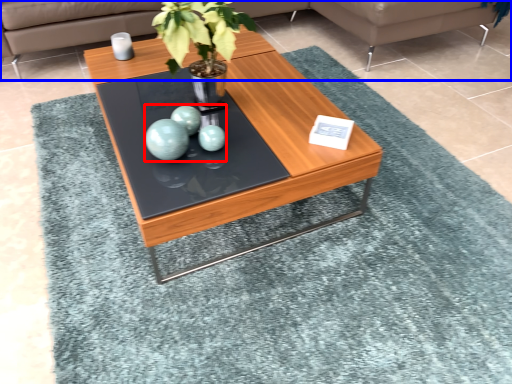
Question: Which object is further to the camera taking this photo, teal (highlighted by a red box) or studio couch (highlighted by a blue box)?

Choices:
 (A) teal
 (B) studio couch

Answer: (B)